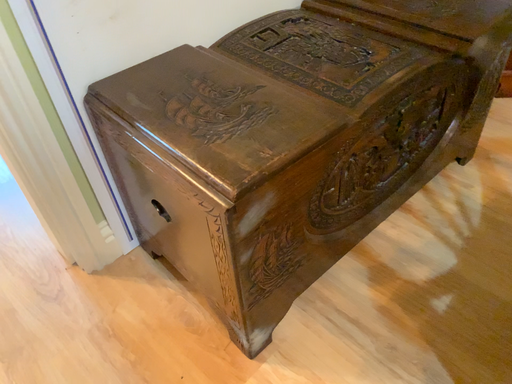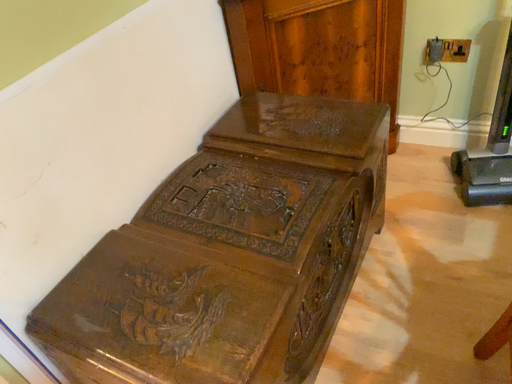
Question: How did the camera likely rotate when shooting the video?

Choices:
 (A) rotated right
 (B) rotated left

Answer: (A)